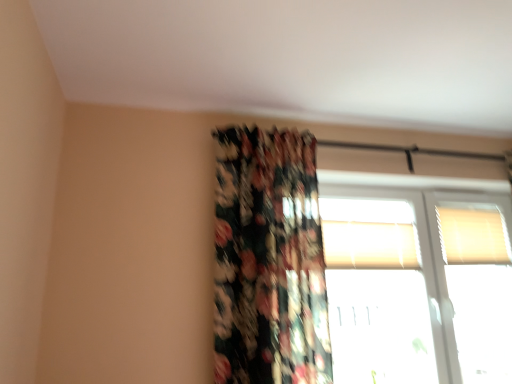
Question: Considering the relative positions of transparent glass window at upper right, marked as the 1th window in a bottom-to-top arrangement, and white textured blinds at upper right, the 3th window positioned from the bottom, in the image provided, is transparent glass window at upper right, marked as the 1th window in a bottom-to-top arrangement, to the left or to the right of white textured blinds at upper right, the 3th window positioned from the bottom,?

Choices:
 (A) right
 (B) left

Answer: (B)

Question: Considering the positions of transparent glass window at upper right, the third window when ordered from top to bottom, and white textured blinds at upper right, positioned as the first window in top-to-bottom order, in the image, is transparent glass window at upper right, the third window when ordered from top to bottom, bigger or smaller than white textured blinds at upper right, positioned as the first window in top-to-bottom order,?

Choices:
 (A) small
 (B) big

Answer: (B)

Question: Which of these objects is positioned closest to the transparent glass window at upper right, marked as the 1th window in a bottom-to-top arrangement?

Choices:
 (A) white textured blinds at upper right, the 3th window positioned from the bottom
 (B) floral fabric curtain at center
 (C) white textured blinds at upper center, the second window ordered from the bottom

Answer: (C)

Question: Estimate the real-world distances between objects in this image. Which object is closer to the white textured blinds at upper center, acting as the 2th window starting from the top?

Choices:
 (A) white textured blinds at upper right, positioned as the first window in top-to-bottom order
 (B) transparent glass window at upper right, the third window when ordered from top to bottom
 (C) floral fabric curtain at center

Answer: (B)